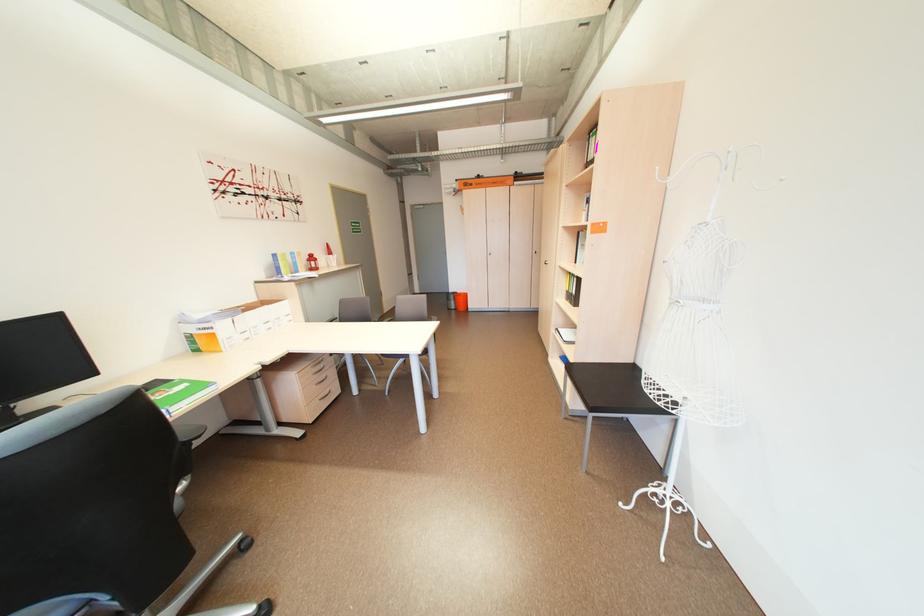
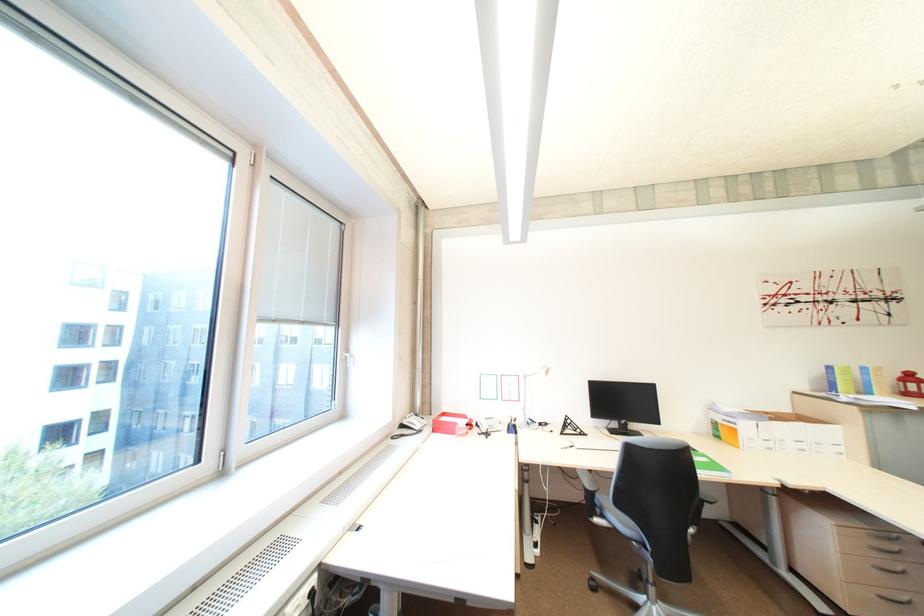
Locate, in the second image, the point that corresponds to pixel 209 387 in the first image.

(725, 468)